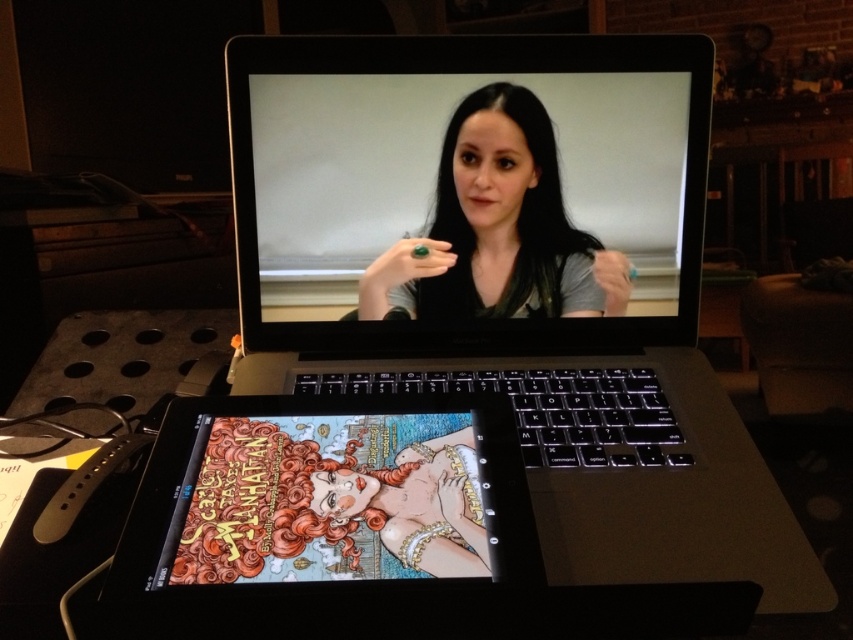
Question: Is the position of sleek silver laptop at center less distant than that of satin black laptop at center?

Choices:
 (A) no
 (B) yes

Answer: (B)

Question: Which object is the farthest from the matte black ring at center?

Choices:
 (A) satin black laptop at center
 (B) sleek silver laptop at center

Answer: (B)

Question: Which point appears closest to the camera in this image?

Choices:
 (A) (456, 193)
 (B) (376, 168)
 (C) (465, 321)

Answer: (B)

Question: Does satin black laptop at center have a smaller size compared to matte black ring at center?

Choices:
 (A) no
 (B) yes

Answer: (A)

Question: Which of these objects is positioned closest to the satin black laptop at center?

Choices:
 (A) sleek silver laptop at center
 (B) matte black ring at center

Answer: (A)

Question: Does sleek silver laptop at center appear under satin black laptop at center?

Choices:
 (A) yes
 (B) no

Answer: (A)